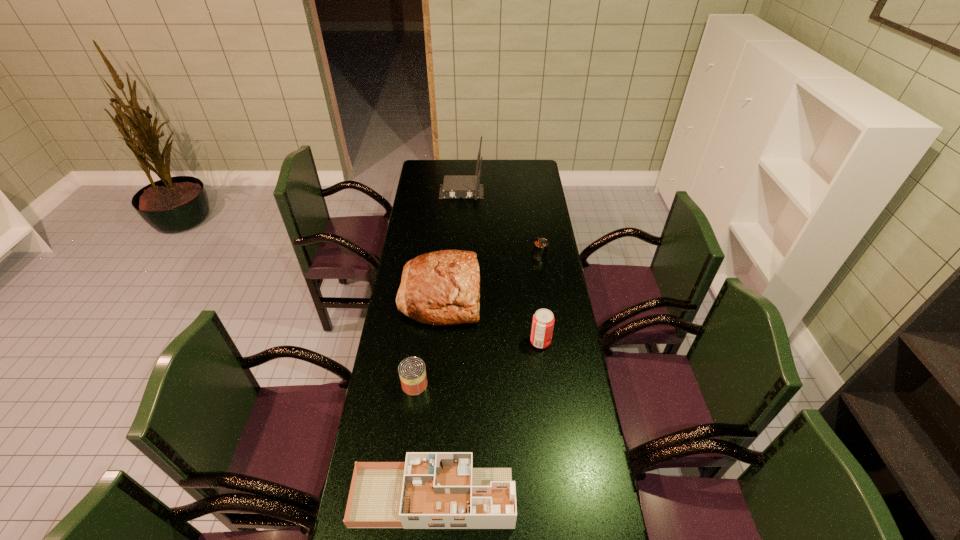
This screenshot has width=960, height=540. I want to click on the second nearest object, so click(x=412, y=372).

This screenshot has height=540, width=960. I want to click on vacant space located 0.380m on the back of the farthest object to connect cables, so click(x=459, y=249).

I want to click on vacant space located 0.350m at the sliced front of the bread, so click(562, 294).

This screenshot has height=540, width=960. In order to click on vacant space located on the back of the third nearest object in this screenshot , I will do `click(537, 311)`.

The height and width of the screenshot is (540, 960). What are the coordinates of `free space located 0.250m on the back of the right can` in the screenshot? It's located at (535, 220).

The height and width of the screenshot is (540, 960). Identify the location of blank area located 0.070m at the front door of the dollhouse. (537, 497).

What are the coordinates of `vacant space located on the back of the left can` in the screenshot? It's located at (421, 330).

The width and height of the screenshot is (960, 540). In order to click on object that is at the far edge in this screenshot , I will do `click(468, 187)`.

Find the location of a particular element. The image size is (960, 540). router present at the left edge is located at coordinates (468, 187).

Where is `bread present at the left edge`? The height and width of the screenshot is (540, 960). bread present at the left edge is located at coordinates (443, 287).